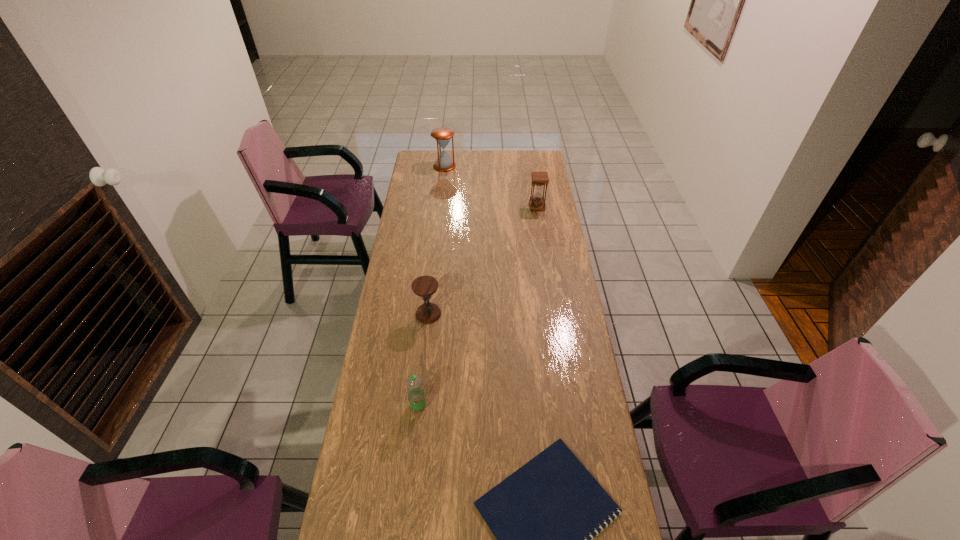
Identify the location of free spot between the farthest hourglass and the third farthest object. (437, 240).

I want to click on free area in between the third farthest object and the farthest object, so click(437, 240).

This screenshot has height=540, width=960. In order to click on vacant area that lies between the second nearest hourglass and the farthest hourglass in this screenshot , I will do `click(491, 186)`.

The image size is (960, 540). Find the location of `vacant area between the fourth farthest object and the fourth nearest object`. vacant area between the fourth farthest object and the fourth nearest object is located at coordinates (478, 306).

Identify the location of object that is the second nearest to the third nearest object. This screenshot has width=960, height=540. (540, 514).

Locate which object is the third closest to the second farthest object. Please provide its 2D coordinates. Your answer should be formatted as a tuple, i.e. [(x, y)], where the tuple contains the x and y coordinates of a point satisfying the conditions above.

[(416, 395)]

This screenshot has width=960, height=540. Identify the location of the closest hourglass to the nearest object. (424, 286).

Locate which hourglass is the second closest to the farthest object. Please provide its 2D coordinates. Your answer should be formatted as a tuple, i.e. [(x, y)], where the tuple contains the x and y coordinates of a point satisfying the conditions above.

[(424, 286)]

Identify the location of vacant area in the image that satisfies the following two spatial constraints: 1. on the back side of the third nearest object; 2. on the right side of the farthest hourglass. (444, 166).

At what (x,y) coordinates should I click in order to perform the action: click on free space that satisfies the following two spatial constraints: 1. on the back side of the nearest hourglass; 2. on the left side of the rightmost hourglass. Please return your answer as a coordinate pair (x, y). Looking at the image, I should click on (440, 206).